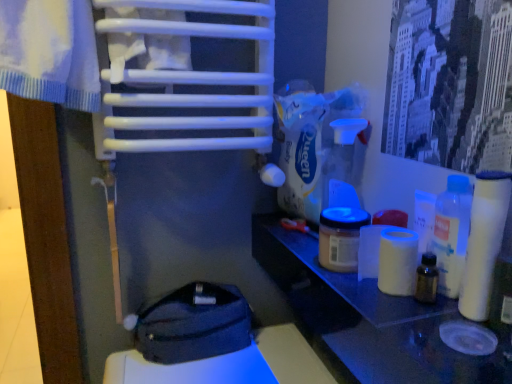
Identify the location of vacant region above white glossy table at right (from a real-world perspective). (361, 278).